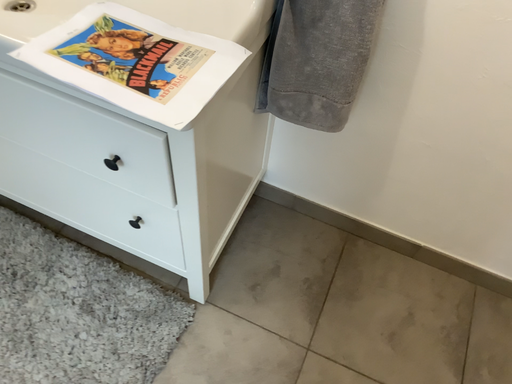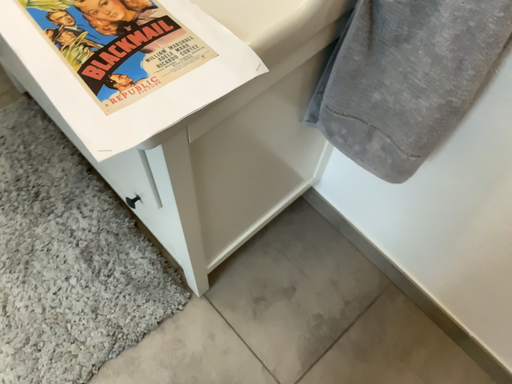
Question: How did the camera likely rotate when shooting the video?

Choices:
 (A) rotated right
 (B) rotated left

Answer: (B)